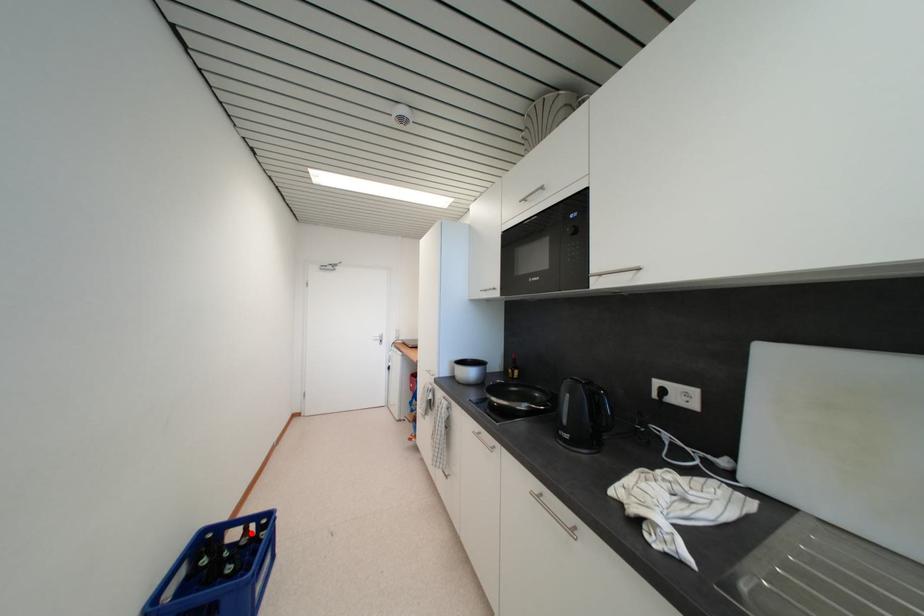
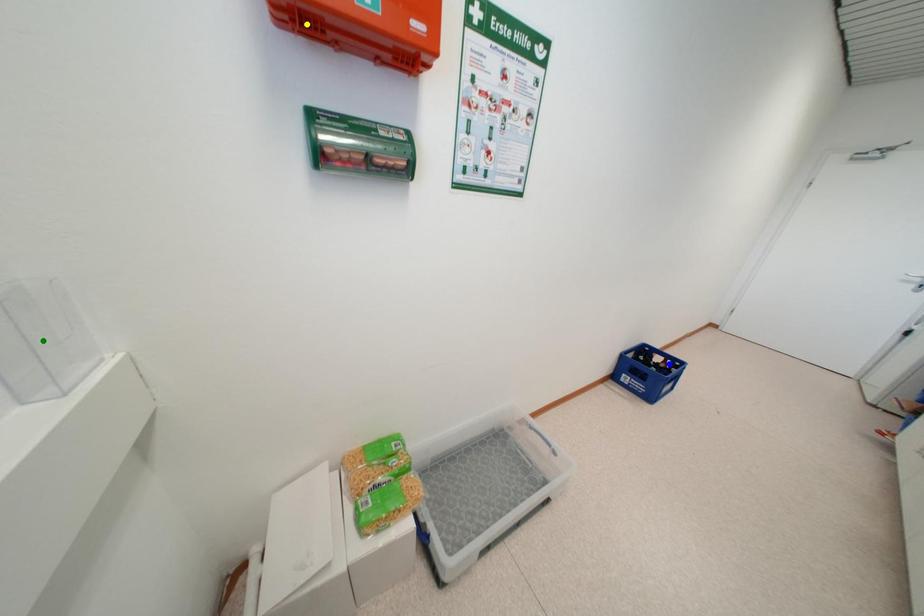
Question: I am providing you with two images of the same scene from different viewpoints. A red point is marked on the first image. You are given multiple points on the second image. In image 2, which mark is for the same physical point as the one in image 1?

Choices:
 (A) green point
 (B) yellow point
 (C) blue point

Answer: (C)